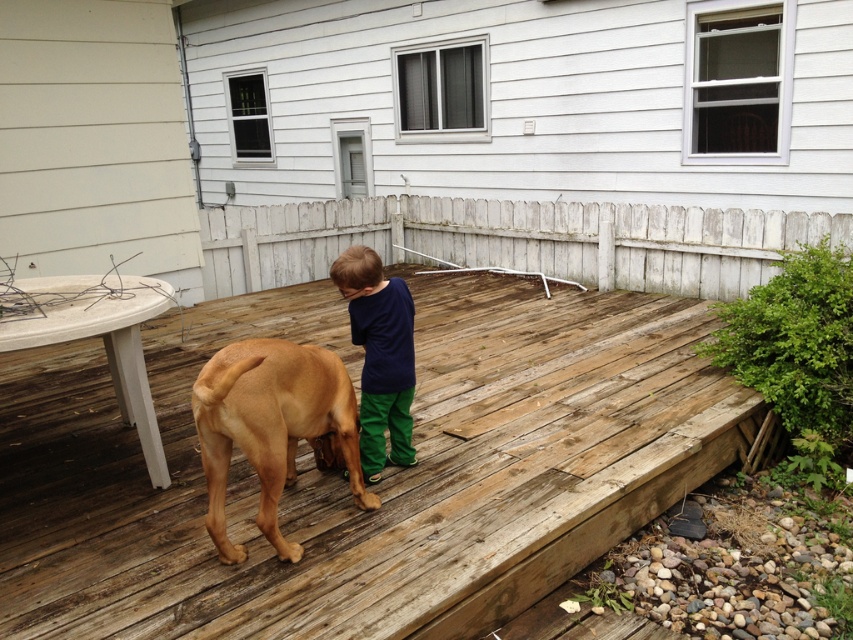
How much distance is there between weathered wood deck at center and dark blue cotton shirt at center?

weathered wood deck at center is 28.85 inches away from dark blue cotton shirt at center.

Is point (103, 422) positioned behind point (364, 449)?

Yes, point (103, 422) is farther from viewer.

Image resolution: width=853 pixels, height=640 pixels. What do you see at coordinates (370, 486) in the screenshot?
I see `weathered wood deck at center` at bounding box center [370, 486].

This screenshot has width=853, height=640. What are the coordinates of `weathered wood deck at center` in the screenshot? It's located at (370, 486).

Is brown smooth dog at center in front of dark blue cotton shirt at center?

That is True.

Is brown smooth dog at center smaller than dark blue cotton shirt at center?

No, brown smooth dog at center is not smaller than dark blue cotton shirt at center.

The width and height of the screenshot is (853, 640). I want to click on brown smooth dog at center, so click(x=271, y=426).

Which is below, weathered wood deck at center or brown smooth dog at center?

Positioned lower is weathered wood deck at center.

Locate an element on the screen. The height and width of the screenshot is (640, 853). weathered wood deck at center is located at coordinates (370, 486).

Identify the location of weathered wood deck at center. (370, 486).